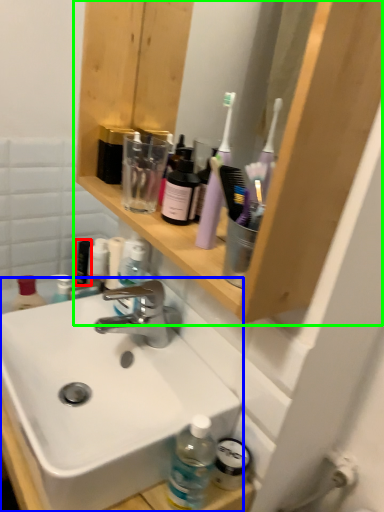
Question: Which object is positioned closest to toiletry (highlighted by a red box)? Select from sink (highlighted by a blue box) and shelf (highlighted by a green box).

Choices:
 (A) sink
 (B) shelf

Answer: (A)